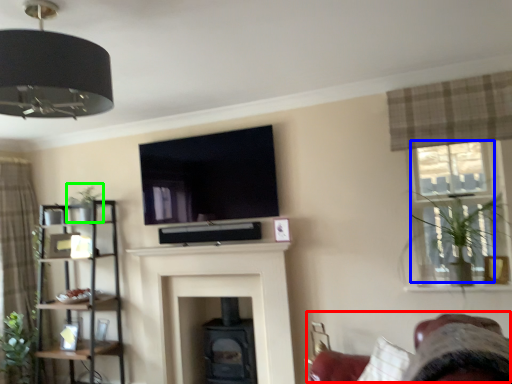
Question: Which is farther away from swivel chair (highlighted by a red box)? window (highlighted by a blue box) or plant (highlighted by a green box)?

Choices:
 (A) window
 (B) plant

Answer: (B)